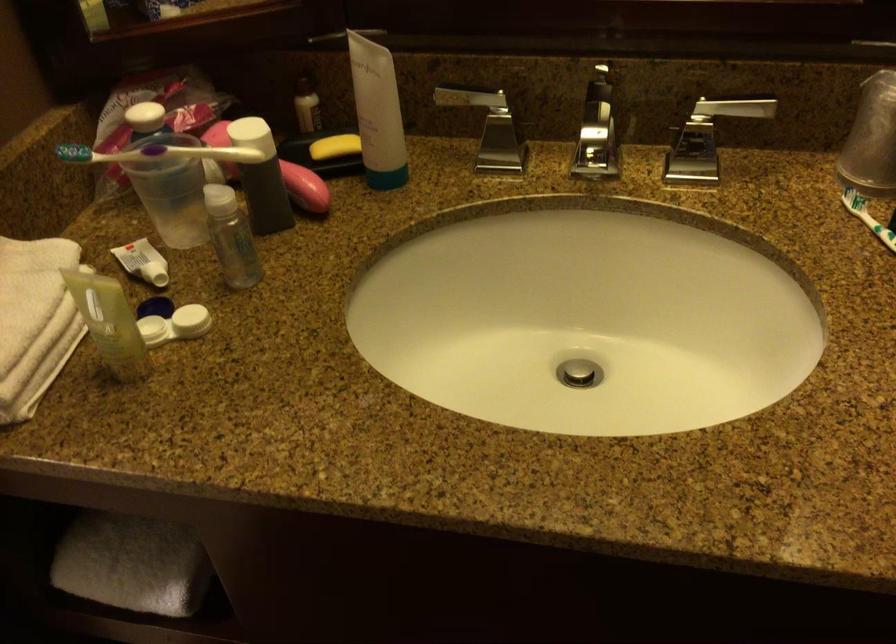
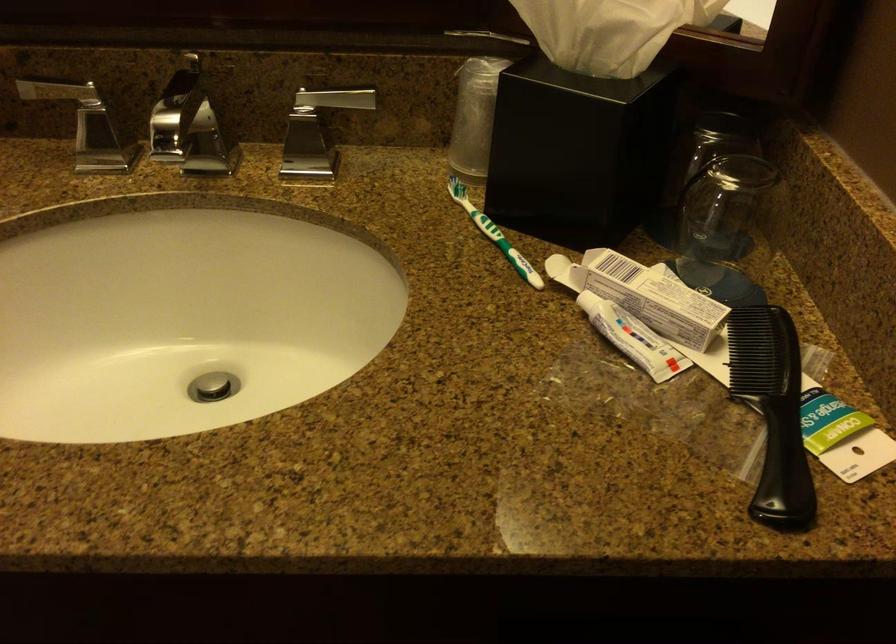
Find the pixel in the second image that matches pixel 583 375 in the first image.

(212, 386)